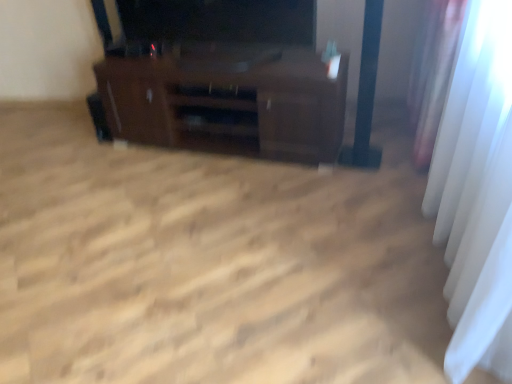
Question: From the image's perspective, is dark brown wood tv stand at center positioned above or below white sheer curtain at right?

Choices:
 (A) below
 (B) above

Answer: (B)

Question: Does point (343, 125) appear closer or farther from the camera than point (490, 155)?

Choices:
 (A) farther
 (B) closer

Answer: (A)

Question: From a real-world perspective, is dark brown wood tv stand at center physically located above or below white sheer curtain at right?

Choices:
 (A) below
 (B) above

Answer: (A)

Question: From the image's perspective, is white sheer curtain at right located above or below dark brown wood tv stand at center?

Choices:
 (A) below
 (B) above

Answer: (A)

Question: Is white sheer curtain at right bigger or smaller than dark brown wood tv stand at center?

Choices:
 (A) small
 (B) big

Answer: (B)

Question: Considering the positions of white sheer curtain at right and dark brown wood tv stand at center in the image, is white sheer curtain at right taller or shorter than dark brown wood tv stand at center?

Choices:
 (A) short
 (B) tall

Answer: (B)

Question: Is white sheer curtain at right wider or thinner than dark brown wood tv stand at center?

Choices:
 (A) thin
 (B) wide

Answer: (A)